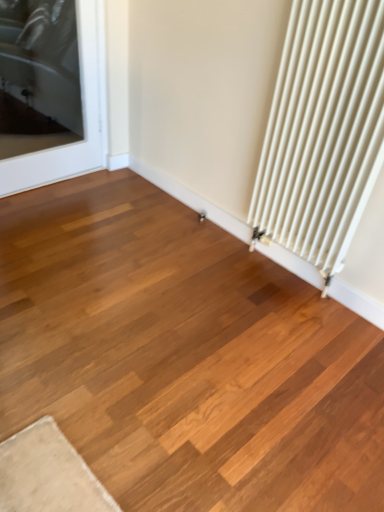
The width and height of the screenshot is (384, 512). What are the coordinates of `free space in front of white matte radiator at right` in the screenshot? It's located at (292, 321).